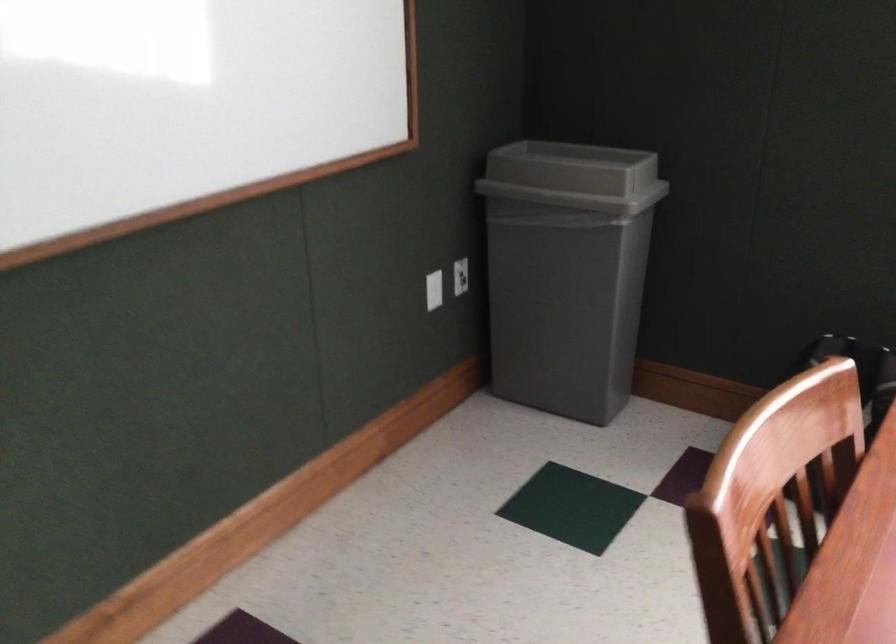
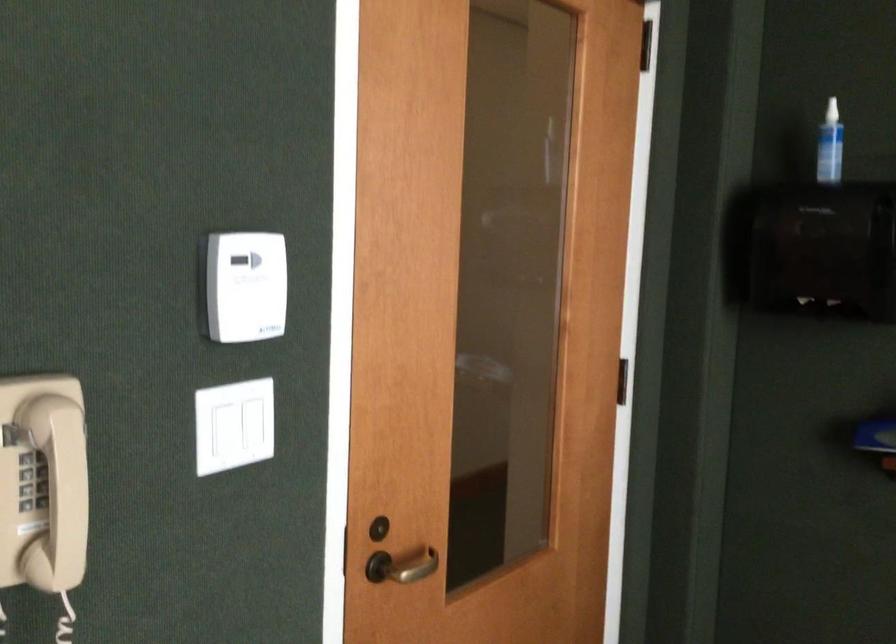
Question: Based on the continuous images, in which direction is the camera rotating? Reply with the corresponding letter.

Choices:
 (A) Left
 (B) Right
 (C) Up
 (D) Down

Answer: (A)